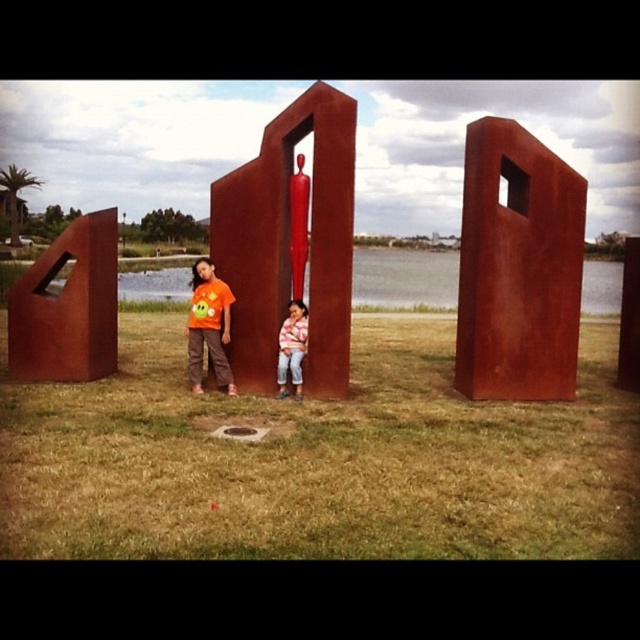
You are a photographer positioned at the edge of the grassy area. You want to take a photo of both the orange matte shirt at left and the striped sweater at center without any obstruction. Based on their positions, which person should you move closer to the camera to ensure both are visible?

The striped sweater at center is behind the orange matte shirt at left, so you should move the striped sweater at center closer to the camera to ensure it is not blocked by the orange matte shirt at left.

In the scene shown: What does the point at coordinates (289, 243) represent in the image?

The point at coordinates (289, 243) corresponds to the rusty metal sculpture at center.

You are standing in front of the metal sculptures and want to take a photo of both point (515,128) and point (212,310). Which point should you focus on first to ensure both are in focus?

You should focus on point (212,310) first because it is closer to the camera than point (515,128). By focusing on the closer point, the depth of field will likely include the farther point as well.